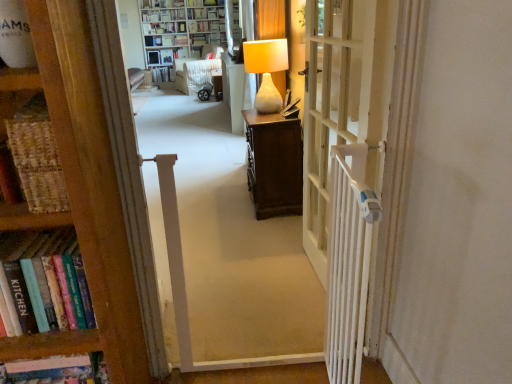
Find the location of a particular element. The width and height of the screenshot is (512, 384). vacant space behind white wooden door at center is located at coordinates (269, 242).